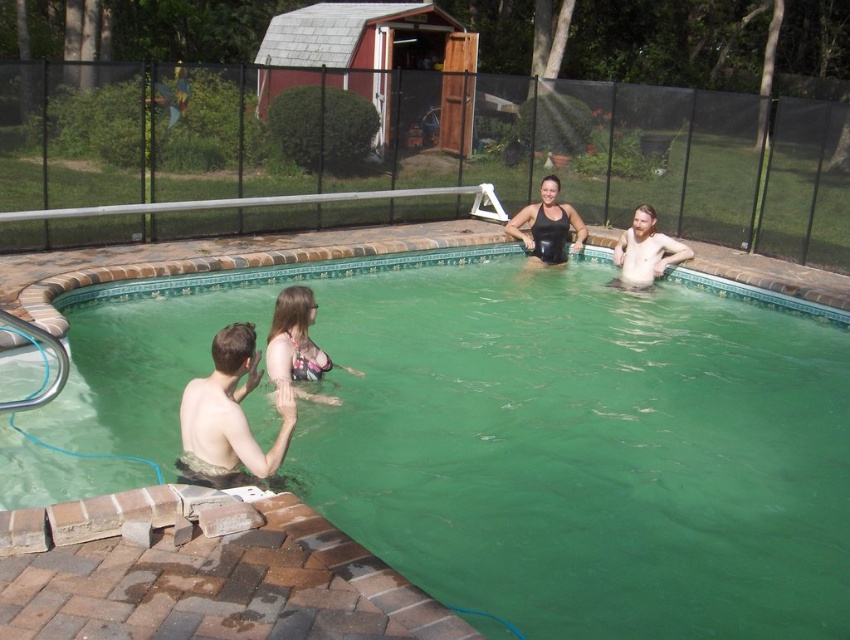
Can you confirm if green smooth water at center is shorter than black matte swimsuit at upper center?

Correct, green smooth water at center is not as tall as black matte swimsuit at upper center.

Does green smooth water at center appear under black matte swimsuit at upper center?

Yes, green smooth water at center is below black matte swimsuit at upper center.

The image size is (850, 640). Describe the element at coordinates (530, 433) in the screenshot. I see `green smooth water at center` at that location.

Locate an element on the screen. This screenshot has width=850, height=640. green smooth water at center is located at coordinates (530, 433).

Does skinny white man at lower left appear over black matte swimsuit at upper center?

Actually, skinny white man at lower left is below black matte swimsuit at upper center.

Does point (197, 422) lie behind point (564, 205)?

No, it is in front of (564, 205).

Is point (213, 396) positioned behind point (553, 243)?

No.

Find the location of a particular element. skinny white man at lower left is located at coordinates (230, 416).

Does black matte swimsuit at upper center have a smaller size compared to shiny brown hair at upper right?

Incorrect, black matte swimsuit at upper center is not smaller in size than shiny brown hair at upper right.

Does black matte swimsuit at upper center have a lesser height compared to shiny brown hair at upper right?

In fact, black matte swimsuit at upper center may be taller than shiny brown hair at upper right.

Which is behind, point (519, 218) or point (683, 257)?

Positioned behind is point (519, 218).

Where is `black matte swimsuit at upper center`? The image size is (850, 640). black matte swimsuit at upper center is located at coordinates (547, 227).